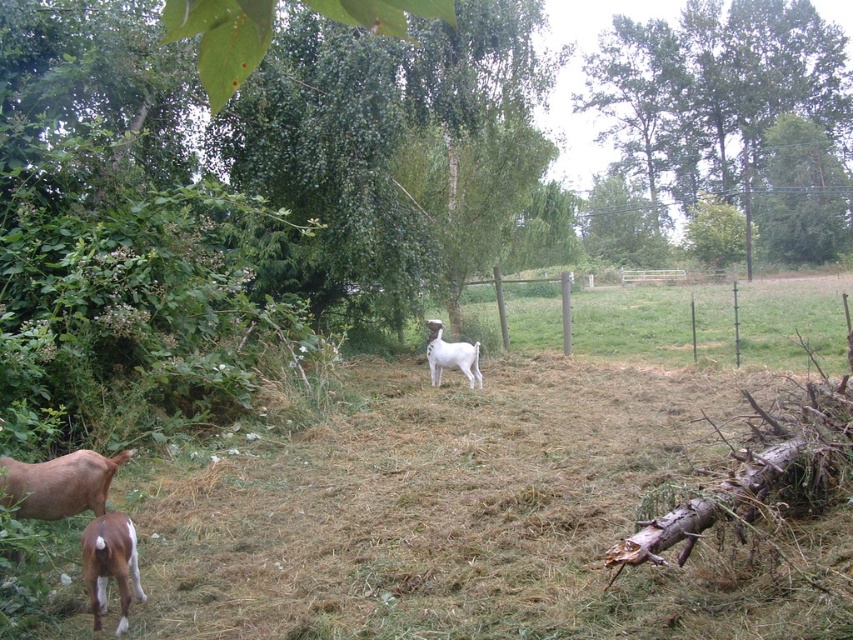
You are standing at the point labeled point (714, 92) in the image. What is the nearest object to you?

The nearest object to the point labeled point (714, 92) is the green leafy tree at upper center, as the point is located on it.

You are a hiker who wants to take a photo of the brown glossy goat at lower left and the white woolen goat at center. Which goat should you focus on first if you want to capture both in the same frame without moving your camera?

The brown glossy goat at lower left is in front of the white woolen goat at center, so you should focus on the brown glossy goat at lower left first to ensure both are in focus since it is closer to the camera.